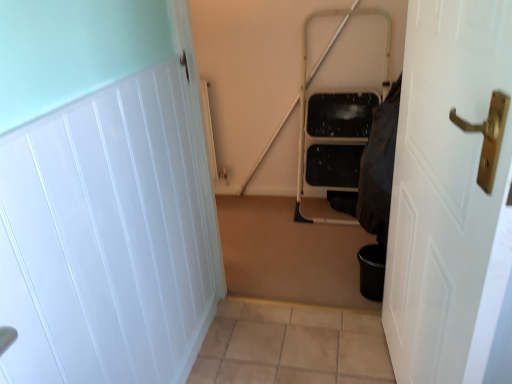
Question: Considering the relative sizes of white glossy door at right, marked as the second door in a left-to-right arrangement, and white glossy door at left, which is the second door in right-to-left order, in the image provided, is white glossy door at right, marked as the second door in a left-to-right arrangement, thinner than white glossy door at left, which is the second door in right-to-left order,?

Choices:
 (A) no
 (B) yes

Answer: (A)

Question: Is white glossy door at right, the first door positioned from the right, to the right of white glossy door at left, which is the second door in right-to-left order, from the viewer's perspective?

Choices:
 (A) yes
 (B) no

Answer: (A)

Question: Is white glossy door at right, marked as the second door in a left-to-right arrangement, turned away from white glossy door at left, marked as the 1th door in a left-to-right arrangement?

Choices:
 (A) no
 (B) yes

Answer: (B)

Question: Is white glossy door at right, marked as the second door in a left-to-right arrangement, shorter than white glossy door at left, which is the second door in right-to-left order?

Choices:
 (A) no
 (B) yes

Answer: (A)

Question: Is white glossy door at right, the first door positioned from the right, at the left side of white glossy door at left, marked as the 1th door in a left-to-right arrangement?

Choices:
 (A) yes
 (B) no

Answer: (B)

Question: Is black fabric at right wider or thinner than white glossy door at left, marked as the 1th door in a left-to-right arrangement?

Choices:
 (A) wide
 (B) thin

Answer: (A)

Question: Do you think black fabric at right is within white glossy door at left, marked as the 1th door in a left-to-right arrangement, or outside of it?

Choices:
 (A) inside
 (B) outside

Answer: (B)

Question: In terms of size, does black fabric at right appear bigger or smaller than white glossy door at left, marked as the 1th door in a left-to-right arrangement?

Choices:
 (A) big
 (B) small

Answer: (B)

Question: Relative to white glossy door at left, which is the second door in right-to-left order, is black fabric at right in front or behind?

Choices:
 (A) front
 (B) behind

Answer: (B)

Question: Does point pos(374,140) appear closer or farther from the camera than point pos(485,271)?

Choices:
 (A) closer
 (B) farther

Answer: (B)

Question: Relative to white glossy door at right, marked as the second door in a left-to-right arrangement, is black fabric at right in front or behind?

Choices:
 (A) front
 (B) behind

Answer: (B)

Question: In terms of height, does black fabric at right look taller or shorter compared to white glossy door at right, the first door positioned from the right?

Choices:
 (A) tall
 (B) short

Answer: (B)

Question: Considering the positions of black fabric at right and white glossy door at right, marked as the second door in a left-to-right arrangement, in the image, is black fabric at right wider or thinner than white glossy door at right, marked as the second door in a left-to-right arrangement,?

Choices:
 (A) thin
 (B) wide

Answer: (B)

Question: From a real-world perspective, is white glossy door at right, marked as the second door in a left-to-right arrangement, physically located above or below white glossy door at left, which is the second door in right-to-left order?

Choices:
 (A) below
 (B) above

Answer: (B)

Question: From the image's perspective, is white glossy door at right, marked as the second door in a left-to-right arrangement, located above or below white glossy door at left, which is the second door in right-to-left order?

Choices:
 (A) below
 (B) above

Answer: (B)